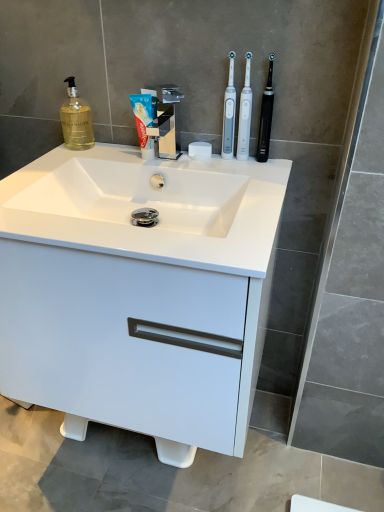
Where is `free space in front of white plastic toothbrush at upper right, positioned as the 2th toothbrush in right-to-left order`? free space in front of white plastic toothbrush at upper right, positioned as the 2th toothbrush in right-to-left order is located at coordinates (253, 178).